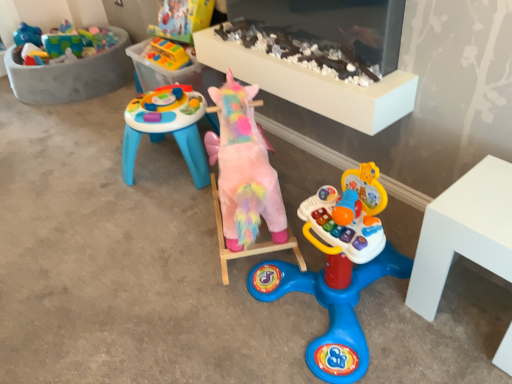
Question: Is pastel plush unicorn at center, marked as the second toy in a bottom-to-top arrangement, a part of fluffy pink unicorn at center, which is the 1th toy from bottom to top?

Choices:
 (A) no
 (B) yes

Answer: (A)

Question: Is fluffy pink unicorn at center, the third toy positioned from the top, taller than pastel plush unicorn at center, marked as the second toy in a bottom-to-top arrangement?

Choices:
 (A) yes
 (B) no

Answer: (A)

Question: Is fluffy pink unicorn at center, the third toy positioned from the top, at the left side of pastel plush unicorn at center, positioned as the 2th toy in top-to-bottom order?

Choices:
 (A) no
 (B) yes

Answer: (B)

Question: Is the position of fluffy pink unicorn at center, which is the 1th toy from bottom to top, less distant than that of pastel plush unicorn at center, marked as the second toy in a bottom-to-top arrangement?

Choices:
 (A) no
 (B) yes

Answer: (B)

Question: Considering the relative sizes of fluffy pink unicorn at center, which is the 1th toy from bottom to top, and pastel plush unicorn at center, marked as the second toy in a bottom-to-top arrangement, in the image provided, is fluffy pink unicorn at center, which is the 1th toy from bottom to top, bigger than pastel plush unicorn at center, marked as the second toy in a bottom-to-top arrangement,?

Choices:
 (A) no
 (B) yes

Answer: (B)

Question: Can you confirm if fluffy pink unicorn at center, the third toy positioned from the top, is shorter than pastel plush unicorn at center, positioned as the 2th toy in top-to-bottom order?

Choices:
 (A) yes
 (B) no

Answer: (B)

Question: From the image's perspective, is pastel plush unicorn at center, positioned as the 2th toy in top-to-bottom order, beneath rubberized plastic toy at upper center, which is the 1th toy in top-to-bottom order?

Choices:
 (A) yes
 (B) no

Answer: (A)

Question: Is pastel plush unicorn at center, positioned as the 2th toy in top-to-bottom order, smaller than rubberized plastic toy at upper center, which is the 1th toy in top-to-bottom order?

Choices:
 (A) yes
 (B) no

Answer: (B)

Question: Is pastel plush unicorn at center, positioned as the 2th toy in top-to-bottom order, not near rubberized plastic toy at upper center, which is the 1th toy in top-to-bottom order?

Choices:
 (A) yes
 (B) no

Answer: (B)

Question: Is pastel plush unicorn at center, positioned as the 2th toy in top-to-bottom order, at the right side of rubberized plastic toy at upper center, which is the 1th toy in top-to-bottom order?

Choices:
 (A) yes
 (B) no

Answer: (A)

Question: Considering the relative sizes of pastel plush unicorn at center, marked as the second toy in a bottom-to-top arrangement, and rubberized plastic toy at upper center, acting as the third toy starting from the bottom, in the image provided, is pastel plush unicorn at center, marked as the second toy in a bottom-to-top arrangement, wider than rubberized plastic toy at upper center, acting as the third toy starting from the bottom,?

Choices:
 (A) no
 (B) yes

Answer: (A)

Question: Is pastel plush unicorn at center, marked as the second toy in a bottom-to-top arrangement, closer to the viewer compared to rubberized plastic toy at upper center, acting as the third toy starting from the bottom?

Choices:
 (A) no
 (B) yes

Answer: (B)

Question: Is pastel plush unicorn at center, positioned as the 2th toy in top-to-bottom order, wider than fluffy pink unicorn at center, which is the 1th toy from bottom to top?

Choices:
 (A) no
 (B) yes

Answer: (A)